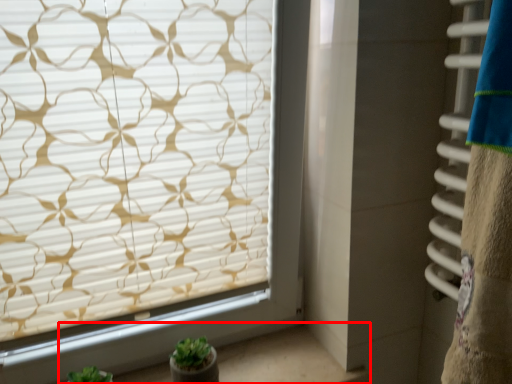
Question: Where is window sill (annotated by the red box) located in relation to window blind in the image?

Choices:
 (A) right
 (B) left

Answer: (A)